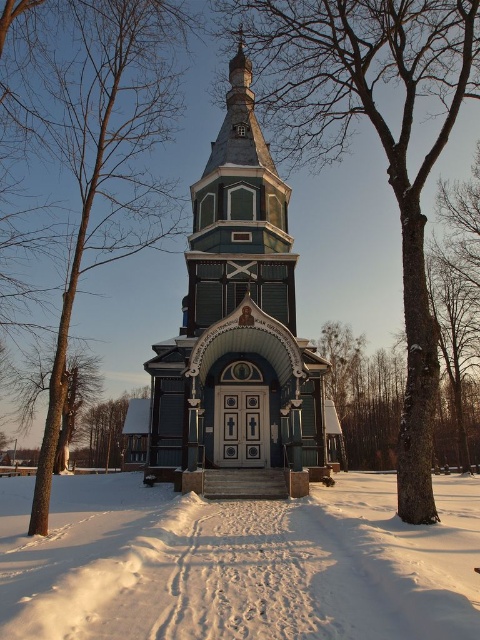
From the picture: You are standing in front of the traditional wooden church in the snowy landscape. There is a point marked at coordinates point (238, 563). What is located at this point?

The point (238, 563) marks white fluffy snow at center.

You are standing in the snowy landscape and want to take a photo of the dark green wood church at center and the brown wood tree at center. Which one should you zoom in on more to capture both in the frame?

The dark green wood church at center is taller than the brown wood tree at center, so you should zoom in more on the church to ensure both are captured in the frame.